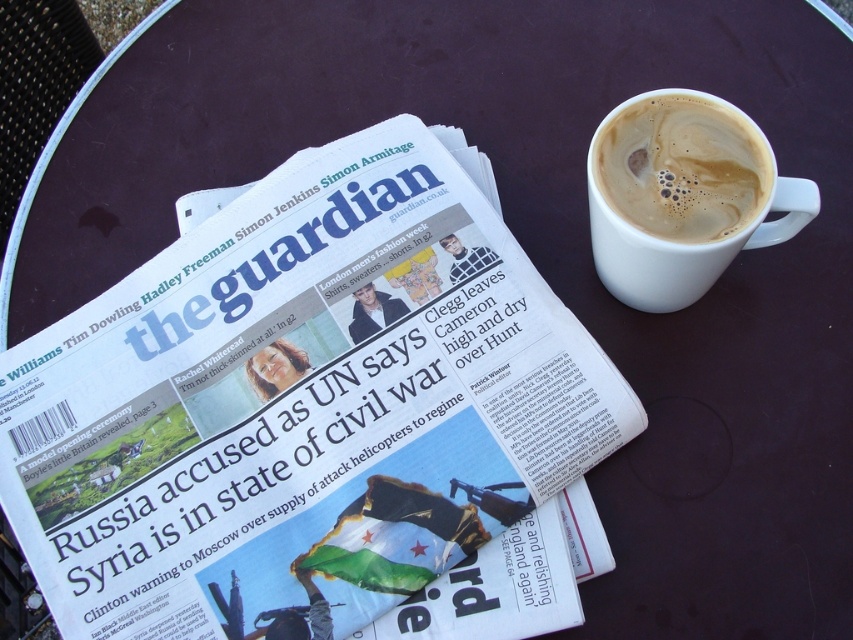
You are a barista who needs to deliver a white ceramic mug at upper right and a white frothy coffee at upper right to a customer. However, you can only carry one item at a time. Which item should you pick first to ensure the customer can see both items clearly from their seat?

You should pick up the white ceramic mug at upper right first because it is closer to the viewer, so the customer will see it first. Then, you can bring the white frothy coffee at upper right afterward to ensure both items are visible.

You are a barista observing the scene. You need to place a lid on the white frothy coffee at upper right. Where should you place the lid relative to the white glossy cup at upper right?

The white glossy cup at upper right is located below the white frothy coffee at upper right, so you should place the lid directly above the white glossy cup at upper right to cover the white frothy coffee at upper right.